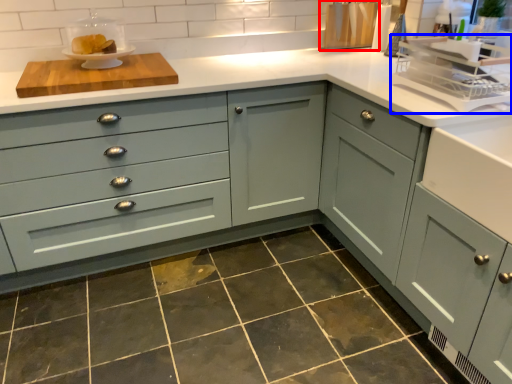
Question: Which point is further to the camera, appliance (highlighted by a red box) or appliance (highlighted by a blue box)?

Choices:
 (A) appliance
 (B) appliance

Answer: (A)